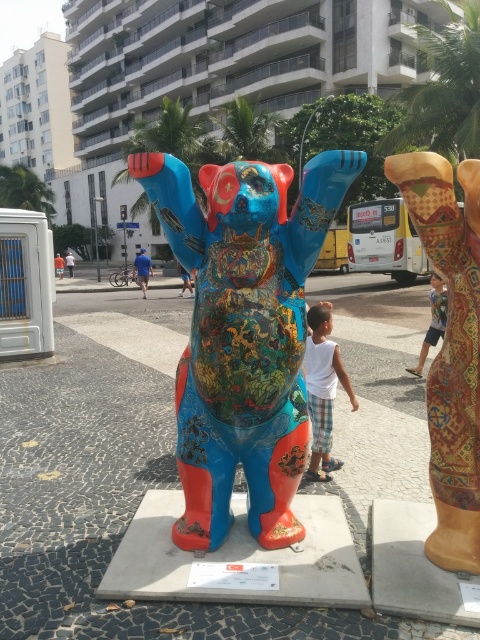
Question: Can you confirm if textured fabric leg at right is thinner than white cotton shirt at center?

Choices:
 (A) no
 (B) yes

Answer: (B)

Question: Is multicolored painted bear at center bigger than white cotton shirt at center?

Choices:
 (A) yes
 (B) no

Answer: (A)

Question: Which point is closer to the camera?

Choices:
 (A) white cotton shirt at center
 (B) light blue denim shorts at lower right

Answer: (A)

Question: Which point appears closest to the camera in this image?

Choices:
 (A) (478, 256)
 (B) (307, 378)

Answer: (A)

Question: Can you confirm if multicolored painted bear at center is bigger than white cotton shirt at center?

Choices:
 (A) no
 (B) yes

Answer: (B)

Question: Which of the following is the farthest from the observer?

Choices:
 (A) pyautogui.click(x=456, y=412)
 (B) pyautogui.click(x=314, y=376)
 (C) pyautogui.click(x=269, y=518)

Answer: (B)